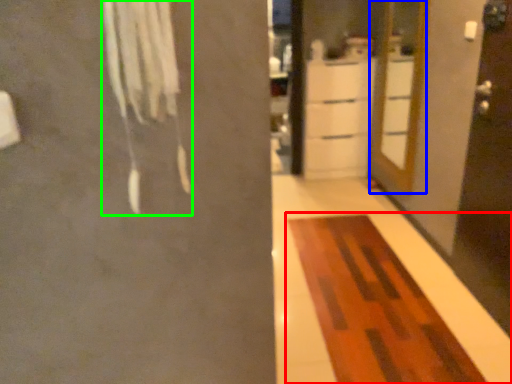
Question: Which object is the farthest from furniture (highlighted by a red box)? Choose among these: door (highlighted by a blue box) or laundry (highlighted by a green box).

Choices:
 (A) door
 (B) laundry

Answer: (B)